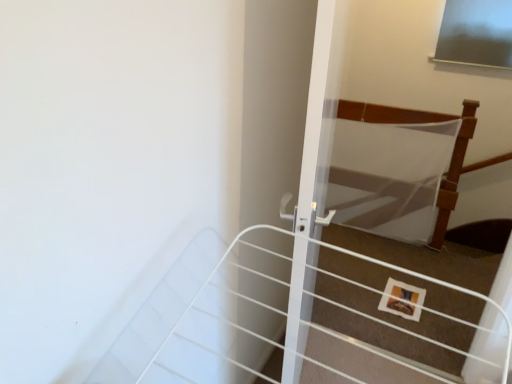
I want to click on white mesh chair at upper right, so click(423, 122).

This screenshot has height=384, width=512. What do you see at coordinates (423, 122) in the screenshot?
I see `white mesh chair at upper right` at bounding box center [423, 122].

At what (x,y) coordinates should I click in order to perform the action: click on white mesh chair at upper right. Please return your answer as a coordinate pair (x, y). The image size is (512, 384). Looking at the image, I should click on (423, 122).